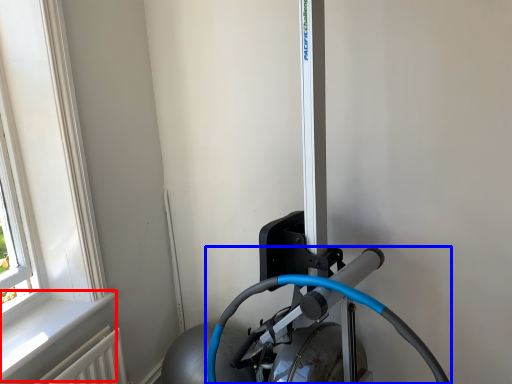
Question: Which object is closer to the camera taking this photo, window sill (highlighted by a red box) or sport equipment (highlighted by a blue box)?

Choices:
 (A) window sill
 (B) sport equipment

Answer: (B)